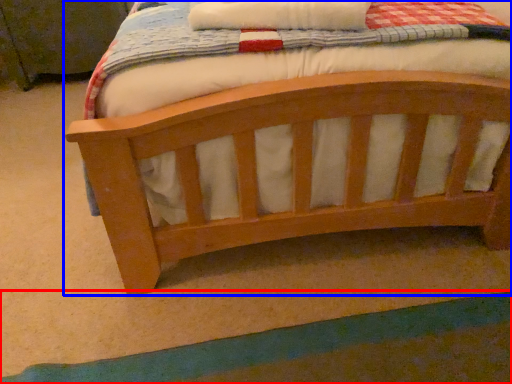
Question: Which object is further to the camera taking this photo, strip (highlighted by a red box) or bed (highlighted by a blue box)?

Choices:
 (A) strip
 (B) bed

Answer: (A)